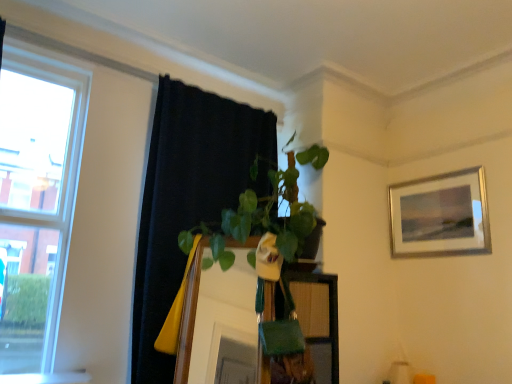
Question: Is white glossy window sill at lower left positioned with its back to clear glass window at left?

Choices:
 (A) yes
 (B) no

Answer: (A)

Question: From a real-world perspective, is white glossy window sill at lower left under clear glass window at left?

Choices:
 (A) yes
 (B) no

Answer: (A)

Question: Considering the relative sizes of white glossy window sill at lower left and clear glass window at left in the image provided, is white glossy window sill at lower left smaller than clear glass window at left?

Choices:
 (A) yes
 (B) no

Answer: (A)

Question: From a real-world perspective, is white glossy window sill at lower left on clear glass window at left?

Choices:
 (A) yes
 (B) no

Answer: (B)

Question: Considering the relative sizes of white glossy window sill at lower left and clear glass window at left in the image provided, is white glossy window sill at lower left bigger than clear glass window at left?

Choices:
 (A) no
 (B) yes

Answer: (A)

Question: In the image, is white glossy window sill at lower left on the left side or the right side of black fabric curtain at upper left?

Choices:
 (A) left
 (B) right

Answer: (A)

Question: In terms of width, does white glossy window sill at lower left look wider or thinner when compared to black fabric curtain at upper left?

Choices:
 (A) thin
 (B) wide

Answer: (A)

Question: From the image's perspective, relative to black fabric curtain at upper left, is white glossy window sill at lower left above or below?

Choices:
 (A) above
 (B) below

Answer: (B)

Question: Does point (7, 379) appear closer or farther from the camera than point (153, 173)?

Choices:
 (A) farther
 (B) closer

Answer: (B)

Question: From the image's perspective, is black fabric curtain at upper left positioned above or below silver metallic picture frame at upper right?

Choices:
 (A) below
 (B) above

Answer: (A)

Question: Is black fabric curtain at upper left wider or thinner than silver metallic picture frame at upper right?

Choices:
 (A) thin
 (B) wide

Answer: (B)

Question: In the image, is black fabric curtain at upper left positioned in front of or behind silver metallic picture frame at upper right?

Choices:
 (A) behind
 (B) front

Answer: (B)

Question: Is black fabric curtain at upper left taller or shorter than silver metallic picture frame at upper right?

Choices:
 (A) tall
 (B) short

Answer: (A)

Question: Based on their positions, is silver metallic picture frame at upper right located to the left or right of clear glass window at left?

Choices:
 (A) right
 (B) left

Answer: (A)

Question: Do you think silver metallic picture frame at upper right is within clear glass window at left, or outside of it?

Choices:
 (A) inside
 (B) outside

Answer: (B)